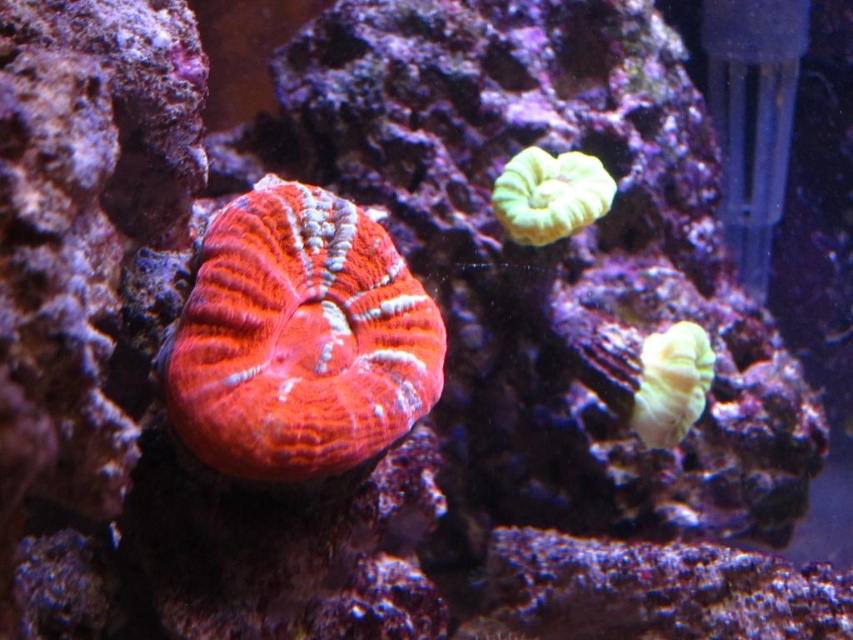
You are an underwater explorer looking at the green matte coral at upper right and the yellow matte coral at right. Which coral is nearer to you?

The green matte coral at upper right is closer to the viewer than the yellow matte coral at right.

You are a marine biologist observing this underwater scene through a glass window. You notice a point at coordinates point (192, 305) that you want to measure. If your measuring tool has a maximum reach of 30 inches, can you reach that point with your tool?

The point (192, 305) is 35.46 inches away from the camera, which exceeds the measuring tool maximum reach of 30 inches. Therefore, you cannot reach the point with your tool.

You are a scuba diver swimming towards the center of the underwater scene. You see the matte coral at center and the green matte coral at upper right. Which coral will you encounter first as you move forward?

You will encounter the matte coral at center first because it is closer to you than the green matte coral at upper right, which is further away.